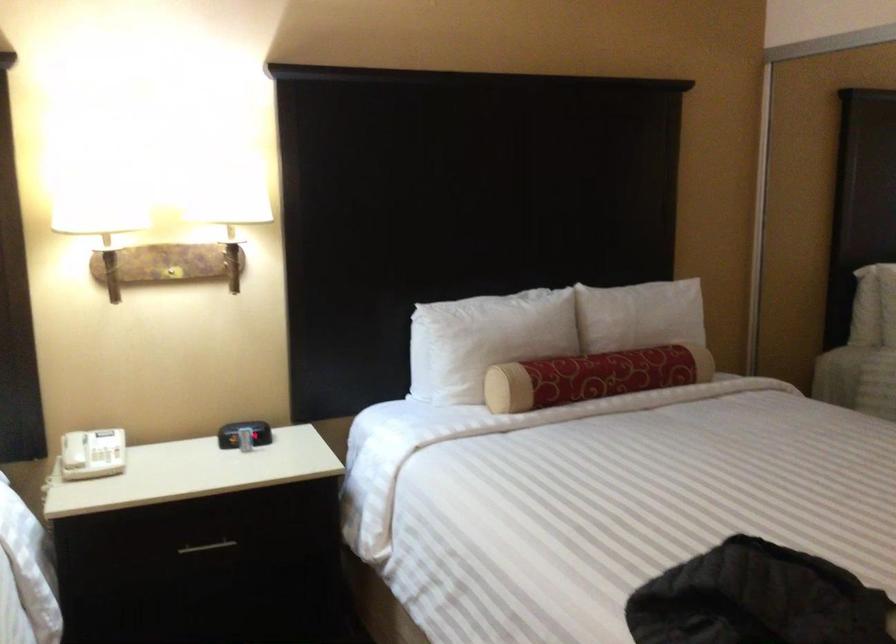
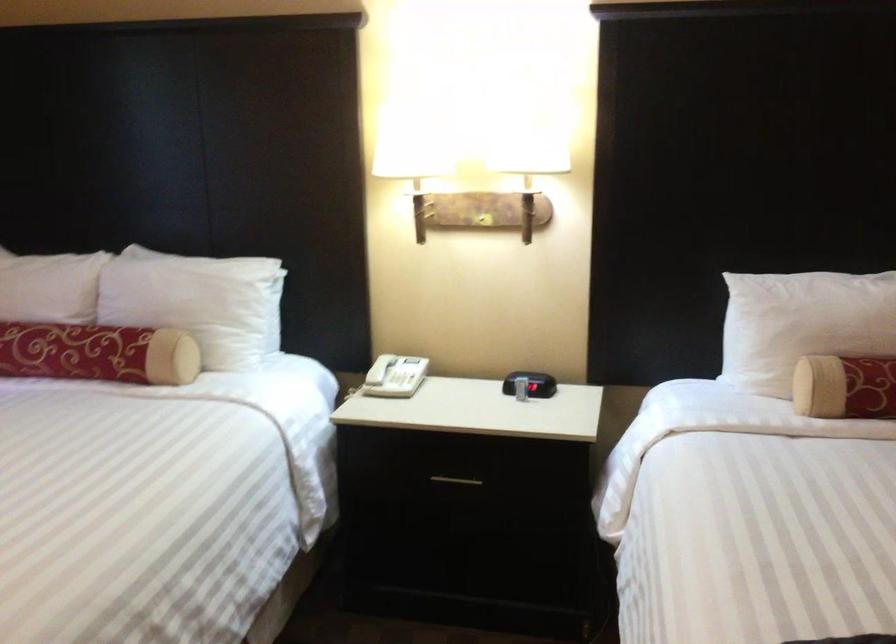
Where in the second image is the point corresponding to point 202,549 from the first image?

(455, 480)